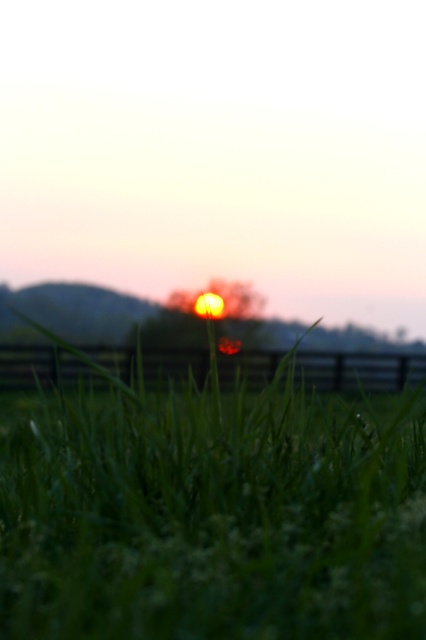
You are standing in the middle of the green grassy at center and want to walk towards the black wooden fence at lower center. Which direction should you head to reach the fence?

You should head forward because the black wooden fence at lower center is in front of you, closer to the viewer than the green grassy at center.